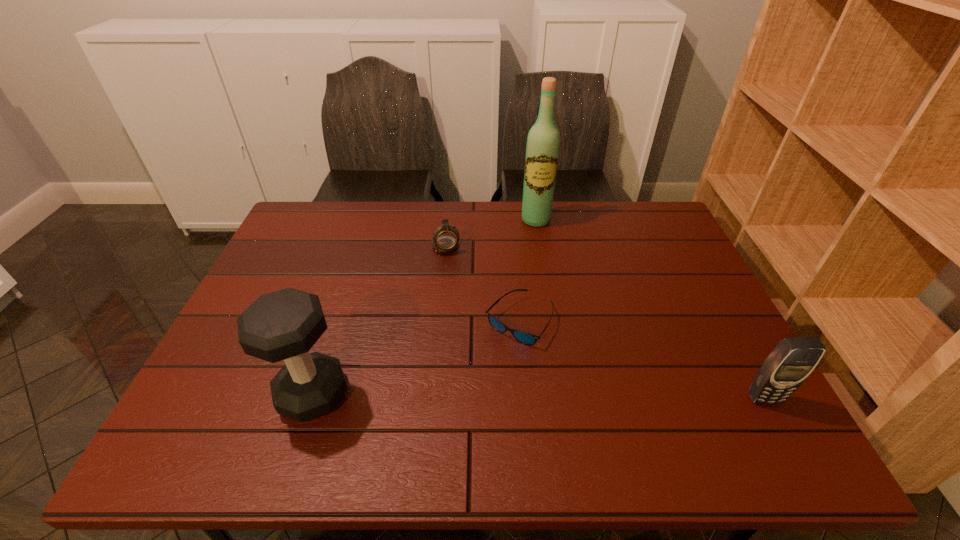
Find the location of `vacant position located 0.190m on the back of the leftmost object`. vacant position located 0.190m on the back of the leftmost object is located at coordinates (341, 307).

At what (x,y) coordinates should I click in order to perform the action: click on free region located 0.300m on the face of the second farthest object. Please return your answer as a coordinate pair (x, y). This screenshot has height=540, width=960. Looking at the image, I should click on (466, 329).

Locate an element on the screen. The height and width of the screenshot is (540, 960). free location located on the face of the second farthest object is located at coordinates (468, 335).

Where is `free location located 0.090m on the face of the second farthest object`? This screenshot has height=540, width=960. free location located 0.090m on the face of the second farthest object is located at coordinates (453, 275).

Identify the location of vacant space located at the front of the shortest object showing the lenses. (525, 369).

The width and height of the screenshot is (960, 540). In order to click on free space located 0.100m at the front of the shortest object showing the lenses in this screenshot , I will do `click(527, 384)`.

At what (x,y) coordinates should I click in order to perform the action: click on free spot located at the front of the shortest object showing the lenses. Please return your answer as a coordinate pair (x, y). Looking at the image, I should click on (528, 392).

This screenshot has height=540, width=960. I want to click on vacant space located on the front-facing side of the tallest object, so click(x=540, y=289).

Locate an element on the screen. Image resolution: width=960 pixels, height=540 pixels. free spot located 0.370m on the front-facing side of the tallest object is located at coordinates (542, 310).

This screenshot has height=540, width=960. I want to click on free spot located on the front-facing side of the tallest object, so click(540, 280).